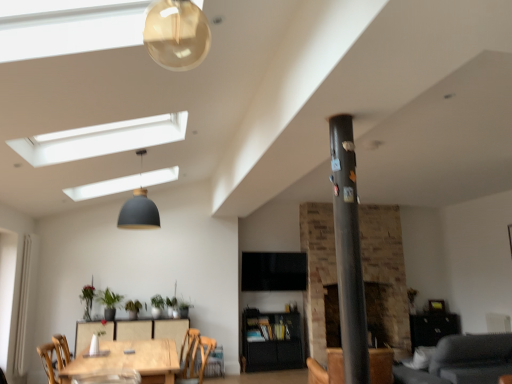
Question: Looking at the image, does gray fabric couch at lower right seem bigger or smaller compared to wooden chair at lower center?

Choices:
 (A) small
 (B) big

Answer: (B)

Question: Do you think gray fabric couch at lower right is within wooden chair at lower center, or outside of it?

Choices:
 (A) inside
 (B) outside

Answer: (B)

Question: Which object is positioned closest to the green matte plant at lower left, the fourth plant viewed from the right?

Choices:
 (A) metallic gray pole at center
 (B) gray fabric couch at lower right
 (C) wooden table at center, positioned as the 1th table in front-to-back order
 (D) green leafy plant at center, the third plant viewed from the left
 (E) green matte plant at center, the 4th plant from the left

Answer: (D)

Question: Estimate the real-world distances between objects in this image. Which object is farther from the wooden table at center, marked as the second table in a front-to-back arrangement?

Choices:
 (A) brown leather armchair at center
 (B) green matte plant at center, acting as the first plant starting from the right
 (C) matte black pendant lamp at upper center
 (D) green leafy plant at center, which ranks as the second plant in right-to-left order
 (E) gray fabric couch at lower right

Answer: (E)